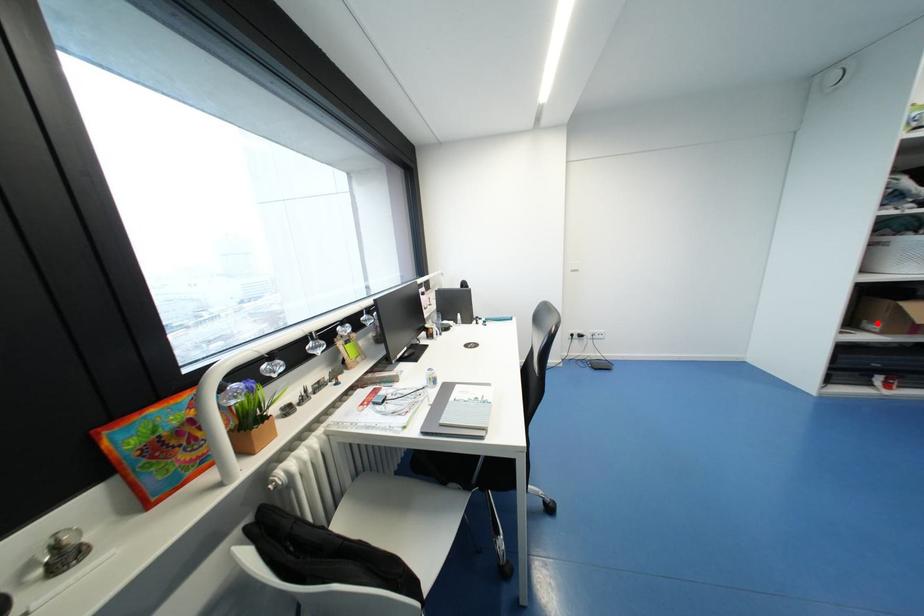
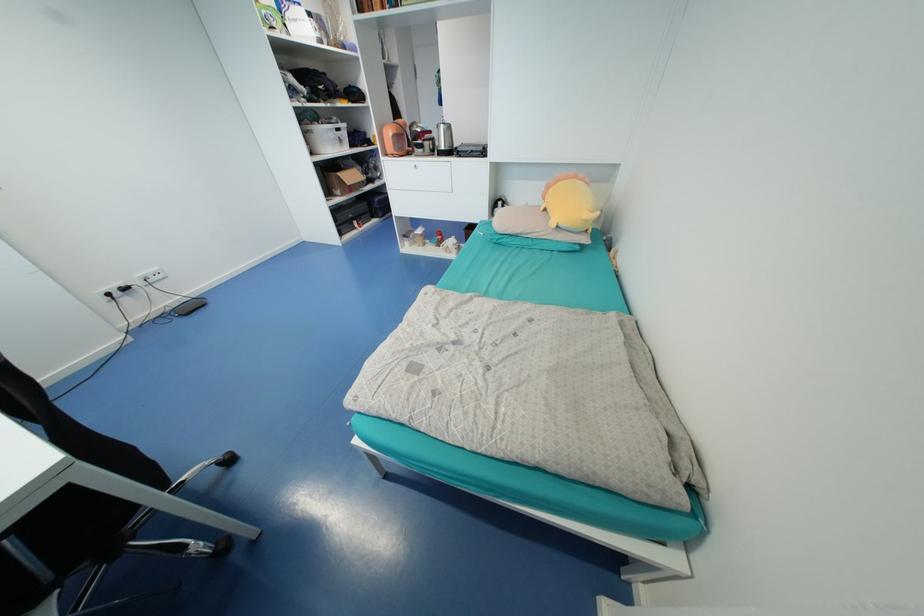
Question: I am providing you with two images of the same scene from different viewpoints. Image1 has a red point marked. In image2, the corresponding 3D location appears at what relative position? Reply with the corresponding letter.

Choices:
 (A) Closer
 (B) Farther

Answer: (A)